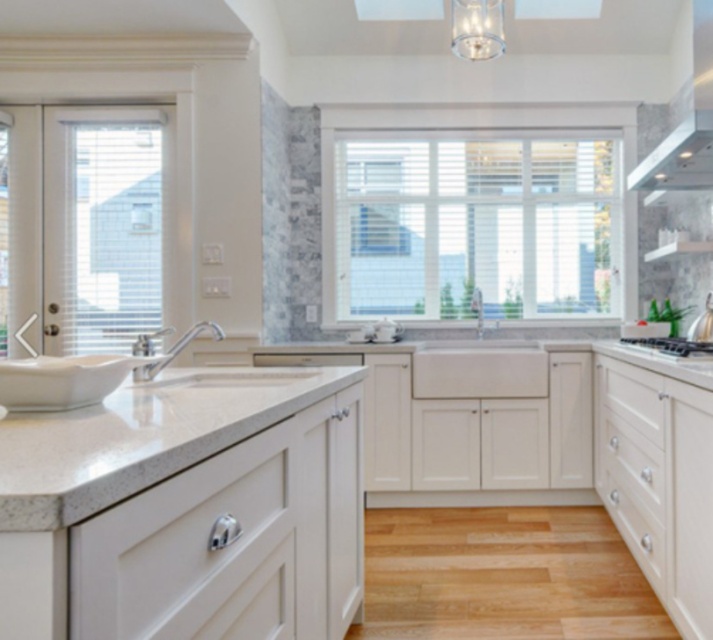
Is white glossy exhaust hood at upper right closer to the viewer compared to satin nickel faucet at center?

No, it is behind satin nickel faucet at center.

Who is positioned more to the right, white glossy exhaust hood at upper right or satin nickel faucet at center?

Positioned to the right is white glossy exhaust hood at upper right.

Is point (707, 134) positioned after point (170, 348)?

No.

Identify the location of white glossy exhaust hood at upper right. (687, 124).

This screenshot has width=713, height=640. Find the location of `white wood window at center`. white wood window at center is located at coordinates (473, 227).

Does white wood window at center have a lesser height compared to white granite countertop at lower left?

No.

The width and height of the screenshot is (713, 640). I want to click on white wood window at center, so click(x=473, y=227).

What do you see at coordinates (175, 349) in the screenshot? This screenshot has height=640, width=713. I see `satin nickel faucet at center` at bounding box center [175, 349].

Can you confirm if satin nickel faucet at center is wider than satin nickel stove at right?

No, satin nickel faucet at center is not wider than satin nickel stove at right.

Is point (133, 348) positioned behind point (660, 349)?

No, (133, 348) is closer to viewer.

You are a GUI agent. You are given a task and a screenshot of the screen. Output one action in this format:
    pyautogui.click(x=<x>, y=<y>)
    Task: Click on the satin nickel faucet at center
    The height and width of the screenshot is (640, 713).
    Given the screenshot: What is the action you would take?
    pyautogui.click(x=175, y=349)